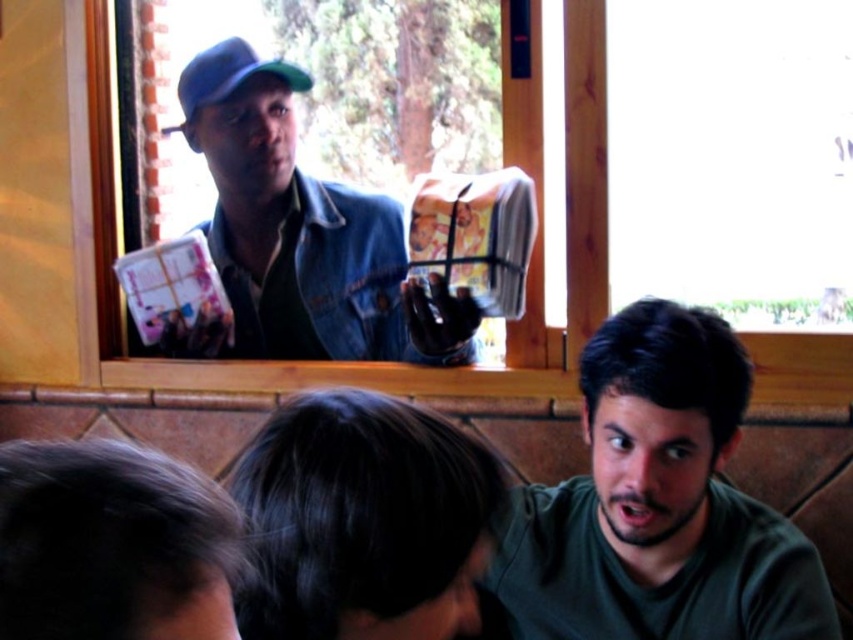
Question: Is green matte shirt at lower right to the right of denim jacket at upper center from the viewer's perspective?

Choices:
 (A) no
 (B) yes

Answer: (B)

Question: Which point is farther to the camera?

Choices:
 (A) green matte shirt at lower right
 (B) denim jacket at upper center
 (C) green matte baseball cap at upper left

Answer: (C)

Question: Which object is positioned closest to the denim jacket at upper center?

Choices:
 (A) green matte shirt at lower right
 (B) green matte baseball cap at upper left

Answer: (B)

Question: Does dark brown hair at lower center appear on the right side of green matte baseball cap at upper left?

Choices:
 (A) yes
 (B) no

Answer: (A)

Question: Can you confirm if green matte shirt at lower right is bigger than dark brown hair at lower center?

Choices:
 (A) yes
 (B) no

Answer: (A)

Question: Among these objects, which one is farthest from the camera?

Choices:
 (A) denim jacket at upper center
 (B) green matte shirt at lower right
 (C) dark brown hair at lower center
 (D) green matte baseball cap at upper left

Answer: (D)